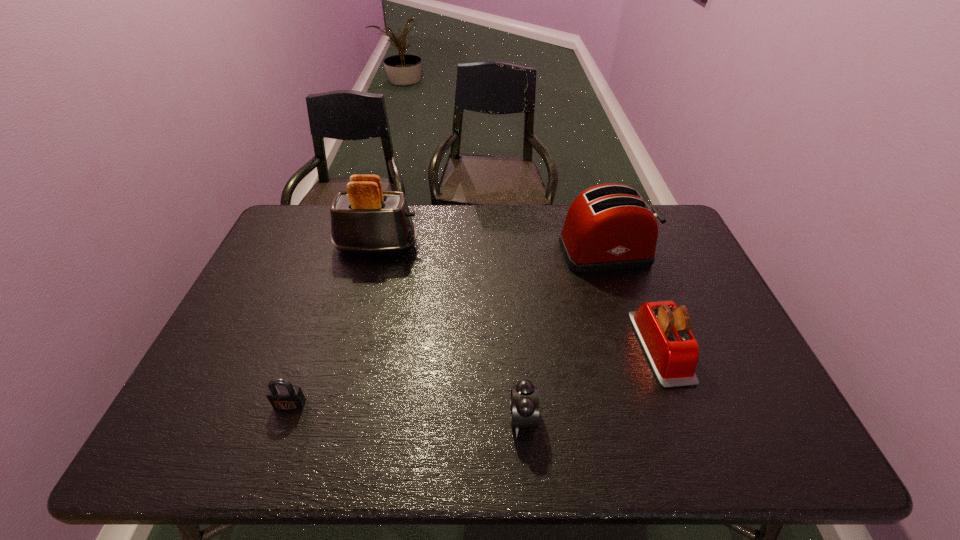
What are the coordinates of `object that is the nearest to the second tallest toaster` in the screenshot? It's located at (663, 329).

Identify the location of object that is the third closest to the third tallest object. (364, 219).

Identify the location of the closest toaster relative to the leftmost toaster. This screenshot has width=960, height=540. (609, 227).

Point out which toaster is positioned as the third nearest to the padlock. Please provide its 2D coordinates. Your answer should be formatted as a tuple, i.e. [(x, y)], where the tuple contains the x and y coordinates of a point satisfying the conditions above.

[(663, 329)]

The height and width of the screenshot is (540, 960). What are the coordinates of `vacant area that satisfies the following two spatial constraints: 1. on the back side of the second tallest toaster; 2. on the side of the leftmost toaster with the control lever` in the screenshot? It's located at (604, 246).

At what (x,y) coordinates should I click in order to perform the action: click on vacant point that satisfies the following two spatial constraints: 1. on the side of the shortest toaster with the control lever; 2. on the left side of the leftmost toaster. Please return your answer as a coordinate pair (x, y). Looking at the image, I should click on (349, 347).

This screenshot has width=960, height=540. In order to click on vacant region that satisfies the following two spatial constraints: 1. on the side of the third tallest object with the control lever; 2. on the right side of the leftmost toaster in this screenshot , I will do pyautogui.click(x=349, y=347).

The width and height of the screenshot is (960, 540). Identify the location of vacant position in the image that satisfies the following two spatial constraints: 1. on the side of the leftmost toaster with the control lever; 2. on the back side of the second tallest object. (375, 253).

This screenshot has height=540, width=960. Identify the location of blank space that satisfies the following two spatial constraints: 1. on the side of the leftmost toaster with the control lever; 2. on the right side of the third nearest object. (349, 347).